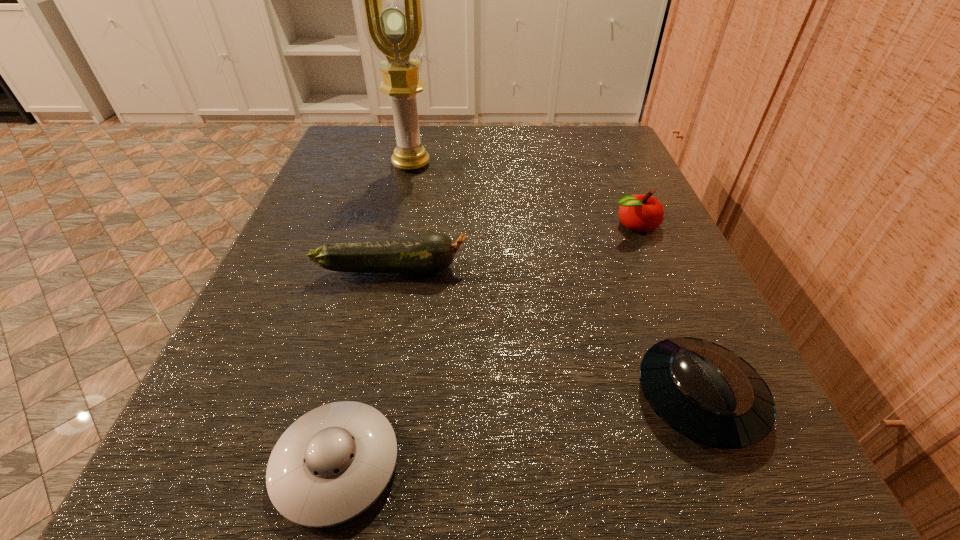
Where is `vacant space situated 0.230m on the left of the right saucer`? vacant space situated 0.230m on the left of the right saucer is located at coordinates (428, 397).

Find the location of a particular element. blank space located on the left of the shortest object is located at coordinates (213, 464).

Image resolution: width=960 pixels, height=540 pixels. What are the coordinates of `object positioned at the far edge` in the screenshot? It's located at (392, 0).

Identify the location of award located at the left edge. Image resolution: width=960 pixels, height=540 pixels. (392, 0).

Locate an element on the screen. zucchini at the left edge is located at coordinates (427, 253).

Where is `saucer at the left edge`? This screenshot has height=540, width=960. saucer at the left edge is located at coordinates (330, 465).

You are a GUI agent. You are given a task and a screenshot of the screen. Output one action in this format:
    pyautogui.click(x=<x>, y=<y>)
    Task: Click on the apple at the right edge
    This screenshot has height=540, width=960.
    Given the screenshot: What is the action you would take?
    pyautogui.click(x=642, y=213)

This screenshot has width=960, height=540. I want to click on saucer located in the right edge section of the desktop, so click(709, 394).

The width and height of the screenshot is (960, 540). I want to click on object that is at the far left corner, so click(x=392, y=0).

This screenshot has height=540, width=960. I want to click on object that is at the near left corner, so click(330, 465).